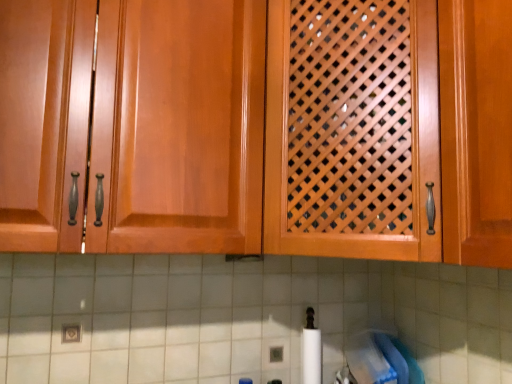
Consider the image. Measure the distance between glossy wood cabinet at center, the second cabinetry viewed from the right, and camera.

32.50 inches.

What do you see at coordinates (241, 316) in the screenshot? I see `white tile at lower center` at bounding box center [241, 316].

In order to face wooden lattice door at center, arranged as the second cabinetry when viewed from the left, should I rotate leftwards or rightwards?

It's best to rotate right around 13.994 degrees.

What do you see at coordinates (304, 129) in the screenshot?
I see `wooden lattice door at center, arranged as the second cabinetry when viewed from the left` at bounding box center [304, 129].

Locate an element on the screen. glossy wood cabinet at center, which ranks as the first cabinetry in left-to-right order is located at coordinates (133, 125).

From the image's perspective, between glossy wood cabinet at center, which ranks as the first cabinetry in left-to-right order, and wooden lattice door at center, arranged as the second cabinetry when viewed from the left, which one is located above?

wooden lattice door at center, arranged as the second cabinetry when viewed from the left, appears higher in the image.

Is glossy wood cabinet at center, which ranks as the first cabinetry in left-to-right order, bigger or smaller than wooden lattice door at center, the first cabinetry positioned from the right?

glossy wood cabinet at center, which ranks as the first cabinetry in left-to-right order, is smaller than wooden lattice door at center, the first cabinetry positioned from the right.

From a real-world perspective, is glossy wood cabinet at center, the second cabinetry viewed from the right, located beneath wooden lattice door at center, arranged as the second cabinetry when viewed from the left?

Correct, in the physical world, glossy wood cabinet at center, the second cabinetry viewed from the right, is lower than wooden lattice door at center, arranged as the second cabinetry when viewed from the left.

How many degrees apart are the facing directions of glossy wood cabinet at center, which ranks as the first cabinetry in left-to-right order, and wooden lattice door at center, the first cabinetry positioned from the right?

There is a 46-degree angle between the facing directions of glossy wood cabinet at center, which ranks as the first cabinetry in left-to-right order, and wooden lattice door at center, the first cabinetry positioned from the right.

From a real-world perspective, relative to white tile at lower center, is glossy wood cabinet at center, the second cabinetry viewed from the right, vertically above or below?

glossy wood cabinet at center, the second cabinetry viewed from the right, is above white tile at lower center.

Based on the photo, how different are the orientations of glossy wood cabinet at center, which ranks as the first cabinetry in left-to-right order, and white tile at lower center in degrees?

The angular difference between glossy wood cabinet at center, which ranks as the first cabinetry in left-to-right order, and white tile at lower center is 0.665 degrees.

You are a GUI agent. You are given a task and a screenshot of the screen. Output one action in this format:
    pyautogui.click(x=<x>, y=<y>)
    Task: Click on the granite located below the glossy wood cabinet at center, which ranks as the first cabinetry in left-to-right order (from the image's perspective)
    The image size is (512, 384).
    Given the screenshot: What is the action you would take?
    pyautogui.click(x=241, y=316)

Is glossy wood cabinet at center, the second cabinetry viewed from the right, in contact with white tile at lower center?

No, glossy wood cabinet at center, the second cabinetry viewed from the right, is not with white tile at lower center.

From the image's perspective, which one is positioned lower, wooden lattice door at center, the first cabinetry positioned from the right, or white tile at lower center?

white tile at lower center is shown below in the image.

Would you say wooden lattice door at center, the first cabinetry positioned from the right, is outside white tile at lower center?

Yes, wooden lattice door at center, the first cabinetry positioned from the right, is located beyond the bounds of white tile at lower center.

Which object is further away from the camera, wooden lattice door at center, arranged as the second cabinetry when viewed from the left, or white tile at lower center?

white tile at lower center is further away from the camera.

Considering the positions of objects wooden lattice door at center, arranged as the second cabinetry when viewed from the left, and white tile at lower center in the image provided, who is more to the right, wooden lattice door at center, arranged as the second cabinetry when viewed from the left, or white tile at lower center?

wooden lattice door at center, arranged as the second cabinetry when viewed from the left.

Looking at the image, does white tile at lower center seem bigger or smaller compared to glossy wood cabinet at center, which ranks as the first cabinetry in left-to-right order?

white tile at lower center is smaller than glossy wood cabinet at center, which ranks as the first cabinetry in left-to-right order.

Is white tile at lower center not close to glossy wood cabinet at center, the second cabinetry viewed from the right?

Actually, white tile at lower center and glossy wood cabinet at center, the second cabinetry viewed from the right, are a little close together.

Is white tile at lower center aimed at glossy wood cabinet at center, which ranks as the first cabinetry in left-to-right order?

No, white tile at lower center does not turn towards glossy wood cabinet at center, which ranks as the first cabinetry in left-to-right order.

From a real-world perspective, is white tile at lower center on wooden lattice door at center, the first cabinetry positioned from the right?

No, from a real-world perspective, white tile at lower center is not over wooden lattice door at center, the first cabinetry positioned from the right

Does point (156, 368) appear closer or farther from the camera than point (415, 55)?

Point (156, 368) is positioned farther from the camera compared to point (415, 55).

Is the position of white tile at lower center less distant than that of wooden lattice door at center, arranged as the second cabinetry when viewed from the left?

That is False.

Which of these two, white tile at lower center or wooden lattice door at center, the first cabinetry positioned from the right, is bigger?

wooden lattice door at center, the first cabinetry positioned from the right, is bigger.

Identify the location of cabinetry to the right of glossy wood cabinet at center, which ranks as the first cabinetry in left-to-right order. (304, 129).

Is wooden lattice door at center, arranged as the second cabinetry when viewed from the left, in front of glossy wood cabinet at center, the second cabinetry viewed from the right?

No.

Is point (387, 53) behind point (184, 207)?

Yes, point (387, 53) is farther from viewer.

Does wooden lattice door at center, the first cabinetry positioned from the right, turn towards glossy wood cabinet at center, the second cabinetry viewed from the right?

No.

Image resolution: width=512 pixels, height=384 pixels. Find the location of `cabinetry below the wooden lattice door at center, arranged as the second cabinetry when viewed from the left (from the image's perspective)`. cabinetry below the wooden lattice door at center, arranged as the second cabinetry when viewed from the left (from the image's perspective) is located at coordinates (133, 125).

Identify the location of the 2nd cabinetry in front of the white tile at lower center. The width and height of the screenshot is (512, 384). (133, 125).

Which object lies further to the anchor point wooden lattice door at center, the first cabinetry positioned from the right, white tile at lower center or glossy wood cabinet at center, which ranks as the first cabinetry in left-to-right order?

white tile at lower center is positioned further to the anchor wooden lattice door at center, the first cabinetry positioned from the right.

Based on the photo, based on their spatial positions, is glossy wood cabinet at center, the second cabinetry viewed from the right, or wooden lattice door at center, arranged as the second cabinetry when viewed from the left, further from white tile at lower center?

Among the two, glossy wood cabinet at center, the second cabinetry viewed from the right, is located further to white tile at lower center.

Estimate the real-world distances between objects in this image. Which object is closer to glossy wood cabinet at center, which ranks as the first cabinetry in left-to-right order, wooden lattice door at center, the first cabinetry positioned from the right, or white tile at lower center?

wooden lattice door at center, the first cabinetry positioned from the right, is positioned closer to the anchor glossy wood cabinet at center, which ranks as the first cabinetry in left-to-right order.

When comparing their distances from wooden lattice door at center, the first cabinetry positioned from the right, does glossy wood cabinet at center, the second cabinetry viewed from the right, or white tile at lower center seem closer?

glossy wood cabinet at center, the second cabinetry viewed from the right, lies closer to wooden lattice door at center, the first cabinetry positioned from the right, than the other object.

Looking at the image, which one is located further to white tile at lower center, wooden lattice door at center, the first cabinetry positioned from the right, or glossy wood cabinet at center, which ranks as the first cabinetry in left-to-right order?

glossy wood cabinet at center, which ranks as the first cabinetry in left-to-right order, is further to white tile at lower center.

From the image, which object appears to be nearer to glossy wood cabinet at center, which ranks as the first cabinetry in left-to-right order, white tile at lower center or wooden lattice door at center, the first cabinetry positioned from the right?

The object closer to glossy wood cabinet at center, which ranks as the first cabinetry in left-to-right order, is wooden lattice door at center, the first cabinetry positioned from the right.

Find the location of a particular element. cabinetry that lies between wooden lattice door at center, the first cabinetry positioned from the right, and white tile at lower center from top to bottom is located at coordinates (133, 125).